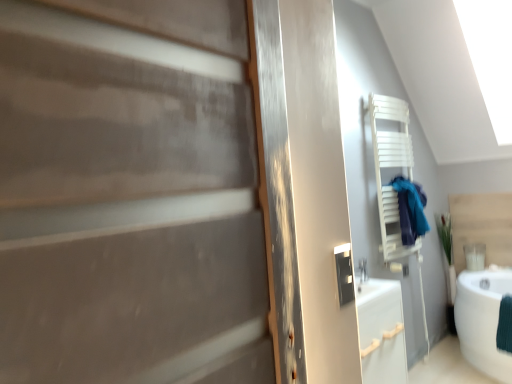
Question: Is point (486, 364) positioned closer to the camera than point (411, 203)?

Choices:
 (A) closer
 (B) farther

Answer: (A)

Question: Considering their positions, is white glossy bathtub at lower right located in front of or behind blue fabric at right?

Choices:
 (A) behind
 (B) front

Answer: (B)

Question: Is white glossy bathtub at lower right wider or thinner than blue fabric at right?

Choices:
 (A) thin
 (B) wide

Answer: (B)

Question: Visually, is blue fabric at right positioned to the left or to the right of white glossy bathtub at lower right?

Choices:
 (A) left
 (B) right

Answer: (A)

Question: Does point click(415, 231) appear closer or farther from the camera than point click(478, 332)?

Choices:
 (A) farther
 (B) closer

Answer: (B)

Question: Is blue fabric at right bigger or smaller than white glossy bathtub at lower right?

Choices:
 (A) big
 (B) small

Answer: (B)

Question: In the image, is blue fabric at right positioned in front of or behind white glossy bathtub at lower right?

Choices:
 (A) front
 (B) behind

Answer: (B)